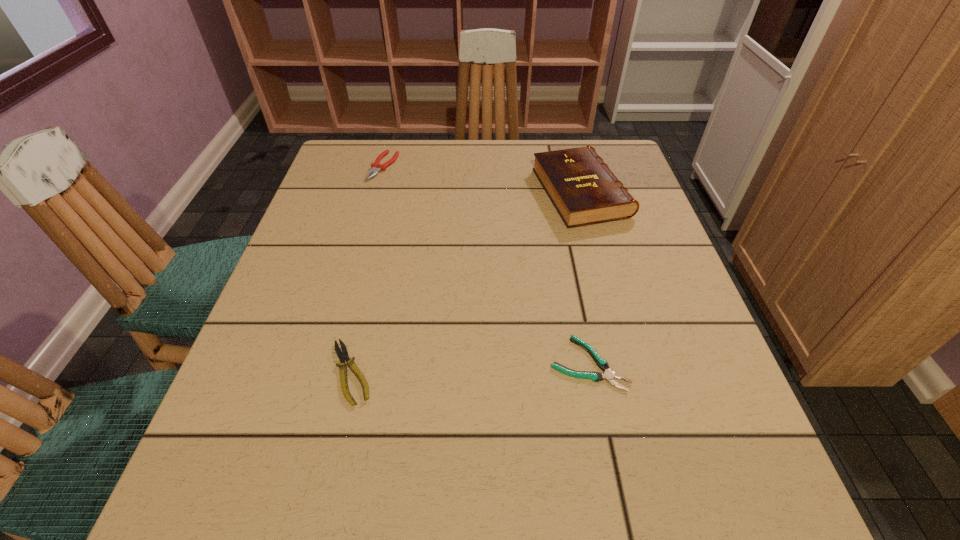
The image size is (960, 540). I want to click on vacant space that is in between the second tallest pliers and the hardback book, so click(467, 282).

Choose which object is the third nearest neighbor to the shortest pliers. Please provide its 2D coordinates. Your answer should be formatted as a tuple, i.e. [(x, y)], where the tuple contains the x and y coordinates of a point satisfying the conditions above.

[(375, 166)]

You are a GUI agent. You are given a task and a screenshot of the screen. Output one action in this format:
    pyautogui.click(x=<x>, y=<y>)
    Task: Click on the object that is the third nearest to the shortest object
    The height and width of the screenshot is (540, 960).
    Given the screenshot: What is the action you would take?
    pyautogui.click(x=375, y=166)

Locate an element on the screen. Image resolution: width=960 pixels, height=540 pixels. the closest pliers relative to the hardback book is located at coordinates (609, 375).

You are a GUI agent. You are given a task and a screenshot of the screen. Output one action in this format:
    pyautogui.click(x=<x>, y=<y>)
    Task: Click on the pliers that can be found as the third closest to the tallest object
    The width and height of the screenshot is (960, 540).
    Given the screenshot: What is the action you would take?
    pyautogui.click(x=343, y=355)

Identify the location of free location that satisfies the following two spatial constraints: 1. on the front side of the farthest pliers; 2. on the right side of the tallest object. This screenshot has width=960, height=540. (376, 193).

In order to click on vacant space that satisfies the following two spatial constraints: 1. on the front side of the second tallest object; 2. on the right side of the shortest object in this screenshot , I will do `click(329, 363)`.